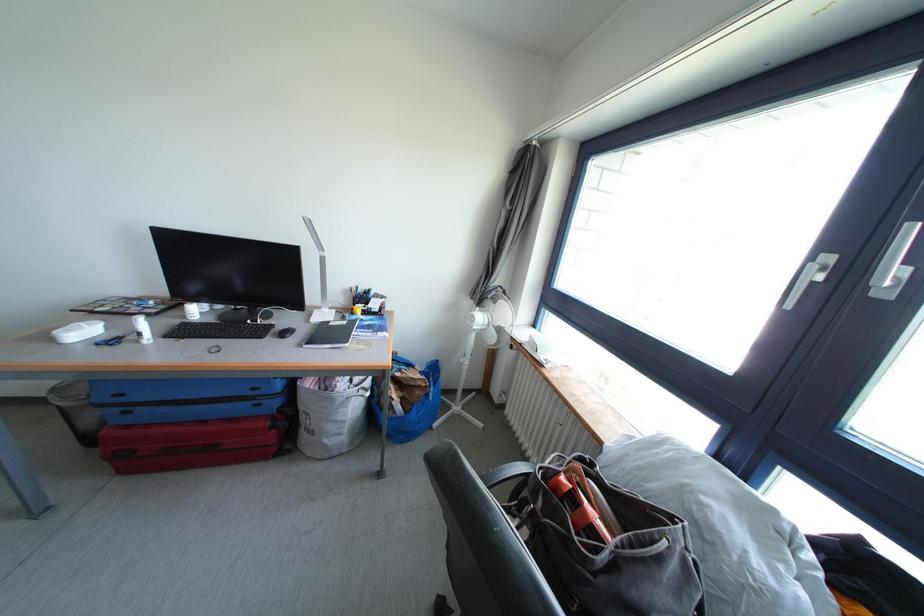
Image resolution: width=924 pixels, height=616 pixels. What do you see at coordinates (78, 331) in the screenshot? I see `the white container lid` at bounding box center [78, 331].